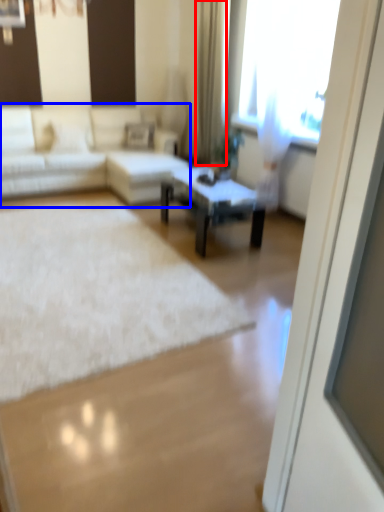
Question: Which of the following is the farthest to the observer, curtain (highlighted by a red box) or studio couch (highlighted by a blue box)?

Choices:
 (A) curtain
 (B) studio couch

Answer: (A)